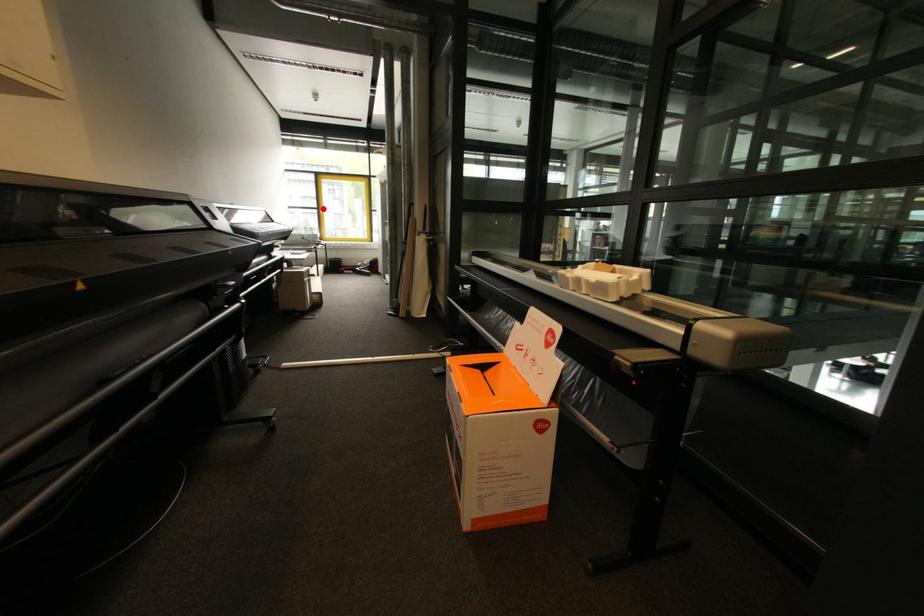
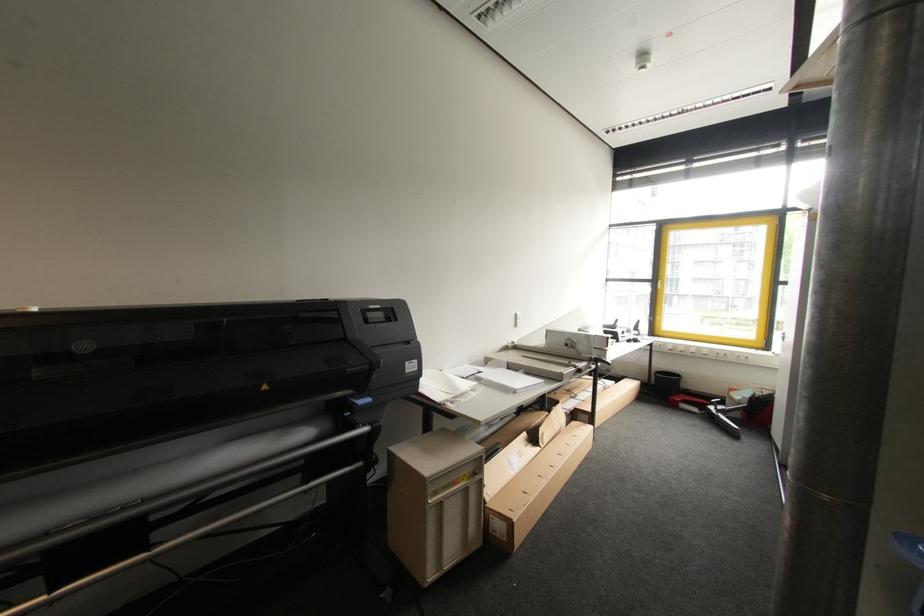
Question: I am providing you with two images of the same scene from different viewpoints. A red point is shown in image1. For the corresponding object point in image2, is it positioned nearer or farther from the camera?

Choices:
 (A) Nearer
 (B) Farther

Answer: (B)